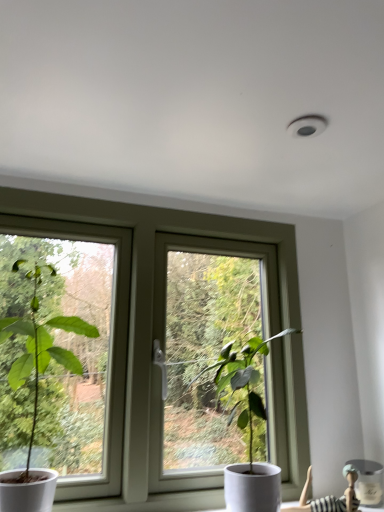
The height and width of the screenshot is (512, 384). What do you see at coordinates (36, 393) in the screenshot?
I see `green matte plant at left, which is the 1th houseplant in left-to-right order` at bounding box center [36, 393].

Image resolution: width=384 pixels, height=512 pixels. What do you see at coordinates (159, 307) in the screenshot?
I see `white plastic window at center` at bounding box center [159, 307].

In order to face white ceramic vase at lower right, should I rotate leftwards or rightwards?

It's best to rotate right around 21.981 degrees.

Find the location of a particular element. The height and width of the screenshot is (512, 384). green matte plant at center, which is the first houseplant from right to left is located at coordinates (243, 381).

Describe the element at coordinates (243, 381) in the screenshot. Image resolution: width=384 pixels, height=512 pixels. I see `green matte plant at center, which is the first houseplant from right to left` at that location.

Identify the location of green matte plant at left, the second houseplant in the right-to-left sequence. This screenshot has height=512, width=384. (36, 393).

In terms of width, does striped fabric doll at lower right look wider or thinner when compared to green matte plant at left, the second houseplant in the right-to-left sequence?

In the image, striped fabric doll at lower right appears to be more narrow than green matte plant at left, the second houseplant in the right-to-left sequence.

Are striped fabric doll at lower right and green matte plant at left, which is the 1th houseplant in left-to-right order, far apart?

No, striped fabric doll at lower right is not far away from green matte plant at left, which is the 1th houseplant in left-to-right order.

I want to click on couple below the green matte plant at left, the second houseplant in the right-to-left sequence (from the image's perspective), so click(x=330, y=496).

Which object is more forward, white ceramic vase at lower right or striped fabric doll at lower right?

Positioned in front is striped fabric doll at lower right.

Between point (379, 468) and point (348, 500), which one is positioned in front?

Positioned in front is point (348, 500).

Is white ceramic vase at lower right facing towards striped fabric doll at lower right?

No, white ceramic vase at lower right is not aimed at striped fabric doll at lower right.

Which object is thinner, white ceramic vase at lower right or striped fabric doll at lower right?

With smaller width is striped fabric doll at lower right.

Which object is positioned more to the left, green matte plant at left, which is the 1th houseplant in left-to-right order, or white ceramic vase at lower right?

Positioned to the left is green matte plant at left, which is the 1th houseplant in left-to-right order.

From the image's perspective, is green matte plant at left, which is the 1th houseplant in left-to-right order, on top of white ceramic vase at lower right?

Indeed, from the image's perspective, green matte plant at left, which is the 1th houseplant in left-to-right order, is shown above white ceramic vase at lower right.

Is green matte plant at left, which is the 1th houseplant in left-to-right order, aimed at white ceramic vase at lower right?

No, green matte plant at left, which is the 1th houseplant in left-to-right order, is not facing towards white ceramic vase at lower right.

Is point (266, 414) farther from camera compared to point (340, 504)?

No, (266, 414) is in front of (340, 504).

From the image's perspective, which one is positioned lower, green matte plant at center, which is the first houseplant from right to left, or striped fabric doll at lower right?

striped fabric doll at lower right, from the image's perspective.

Is green matte plant at center, which is the first houseplant from right to left, to the left of striped fabric doll at lower right from the viewer's perspective?

Correct, you'll find green matte plant at center, which is the first houseplant from right to left, to the left of striped fabric doll at lower right.

Considering the relative positions of white ceramic vase at lower right and white plastic window at center in the image provided, is white ceramic vase at lower right to the left or to the right of white plastic window at center?

Clearly, white ceramic vase at lower right is on the right of white plastic window at center in the image.

In terms of width, does white ceramic vase at lower right look wider or thinner when compared to white plastic window at center?

Clearly, white ceramic vase at lower right has more width compared to white plastic window at center.

Consider the image. Does white ceramic vase at lower right turn towards white plastic window at center?

No, white ceramic vase at lower right is not facing towards white plastic window at center.

Which of these two, white ceramic vase at lower right or white plastic window at center, is smaller?

white ceramic vase at lower right is smaller.

From the image's perspective, who appears lower, striped fabric doll at lower right or white plastic window at center?

striped fabric doll at lower right appears lower in the image.

Are striped fabric doll at lower right and white plastic window at center located far from each other?

Actually, striped fabric doll at lower right and white plastic window at center are a little close together.

Looking at this image, can you confirm if striped fabric doll at lower right is bigger than white plastic window at center?

Actually, striped fabric doll at lower right might be smaller than white plastic window at center.

Does green matte plant at left, which is the 1th houseplant in left-to-right order, have a larger size compared to white plastic window at center?

No.

Who is taller, green matte plant at left, the second houseplant in the right-to-left sequence, or white plastic window at center?

Standing taller between the two is white plastic window at center.

Is point (41, 326) closer or farther from the camera than point (285, 375)?

Point (41, 326).

What's the angular difference between green matte plant at left, the second houseplant in the right-to-left sequence, and white plastic window at center's facing directions?

green matte plant at left, the second houseplant in the right-to-left sequence, and white plastic window at center are facing 0.39 degrees away from each other.

Identify the location of couple located on the right of green matte plant at left, which is the 1th houseplant in left-to-right order. (330, 496).

Image resolution: width=384 pixels, height=512 pixels. In order to click on couple above the white ceramic vase at lower right (from a real-world perspective) in this screenshot , I will do `click(330, 496)`.

From the picture: Which object lies nearer to the anchor point white ceramic vase at lower right, white plastic window at center or green matte plant at left, which is the 1th houseplant in left-to-right order?

Among the two, white plastic window at center is located nearer to white ceramic vase at lower right.

From the image, which object appears to be nearer to green matte plant at center, arranged as the 2th houseplant when viewed from the left, white ceramic vase at lower right or white plastic window at center?

Based on the image, white plastic window at center appears to be nearer to green matte plant at center, arranged as the 2th houseplant when viewed from the left.

Looking at the image, which one is located further to white ceramic vase at lower right, green matte plant at left, the second houseplant in the right-to-left sequence, or white plastic window at center?

The object further to white ceramic vase at lower right is green matte plant at left, the second houseplant in the right-to-left sequence.

When comparing their distances from green matte plant at center, which is the first houseplant from right to left, does green matte plant at left, the second houseplant in the right-to-left sequence, or white plastic window at center seem further?

green matte plant at left, the second houseplant in the right-to-left sequence, lies further to green matte plant at center, which is the first houseplant from right to left, than the other object.

Based on their spatial positions, is striped fabric doll at lower right or white plastic window at center closer to green matte plant at center, which is the first houseplant from right to left?

white plastic window at center lies closer to green matte plant at center, which is the first houseplant from right to left, than the other object.

Which object lies nearer to the anchor point white plastic window at center, green matte plant at left, which is the 1th houseplant in left-to-right order, or white ceramic vase at lower right?

green matte plant at left, which is the 1th houseplant in left-to-right order, is positioned closer to the anchor white plastic window at center.

When comparing their distances from green matte plant at center, which is the first houseplant from right to left, does green matte plant at left, which is the 1th houseplant in left-to-right order, or white ceramic vase at lower right seem further?

white ceramic vase at lower right lies further to green matte plant at center, which is the first houseplant from right to left, than the other object.

Considering their positions, is green matte plant at center, arranged as the 2th houseplant when viewed from the left, positioned closer to green matte plant at left, the second houseplant in the right-to-left sequence, than striped fabric doll at lower right?

Among the two, green matte plant at center, arranged as the 2th houseplant when viewed from the left, is located nearer to green matte plant at left, the second houseplant in the right-to-left sequence.

The width and height of the screenshot is (384, 512). What are the coordinates of `couple between green matte plant at left, the second houseplant in the right-to-left sequence, and white ceramic vase at lower right, in the horizontal direction` in the screenshot? It's located at (330, 496).

You are a GUI agent. You are given a task and a screenshot of the screen. Output one action in this format:
    pyautogui.click(x=<x>, y=<y>)
    Task: Click on the houseplant between green matte plant at left, which is the 1th houseplant in left-to-right order, and striped fabric doll at lower right
    The image size is (384, 512).
    Given the screenshot: What is the action you would take?
    pyautogui.click(x=243, y=381)

What are the coordinates of `houseplant situated between white plastic window at center and striped fabric doll at lower right from left to right` in the screenshot? It's located at (243, 381).

Identify the location of window between green matte plant at left, the second houseplant in the right-to-left sequence, and white ceramic vase at lower right from left to right. (159, 307).